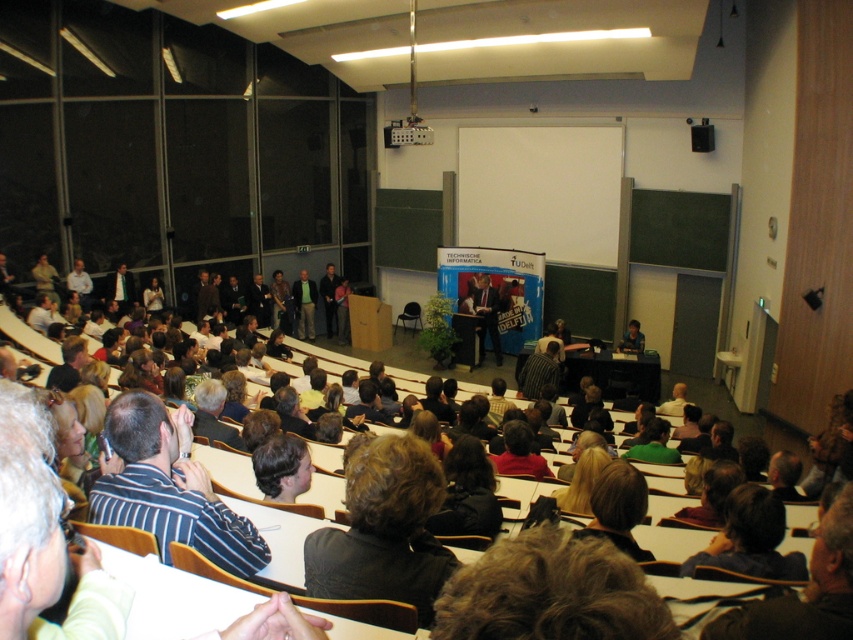
You are an event organizer who needs to seat two speakers, one wearing a dark blue suit at center and the other in a green fabric shirt at center, in chairs of the same size. Based on their clothing sizes, which speaker might require a larger chair?

The dark blue suit at center has a larger size compared to the green fabric shirt at center, so the speaker in the dark blue suit at center would need a larger chair.

You are sitting in the lecture hall and want to determine which of the two points, point (x=103, y=428) or point (x=302, y=320), is closer to you. Based on the scene description, which point is nearer?

Point (x=103, y=428) is closer to the viewer than point (x=302, y=320).